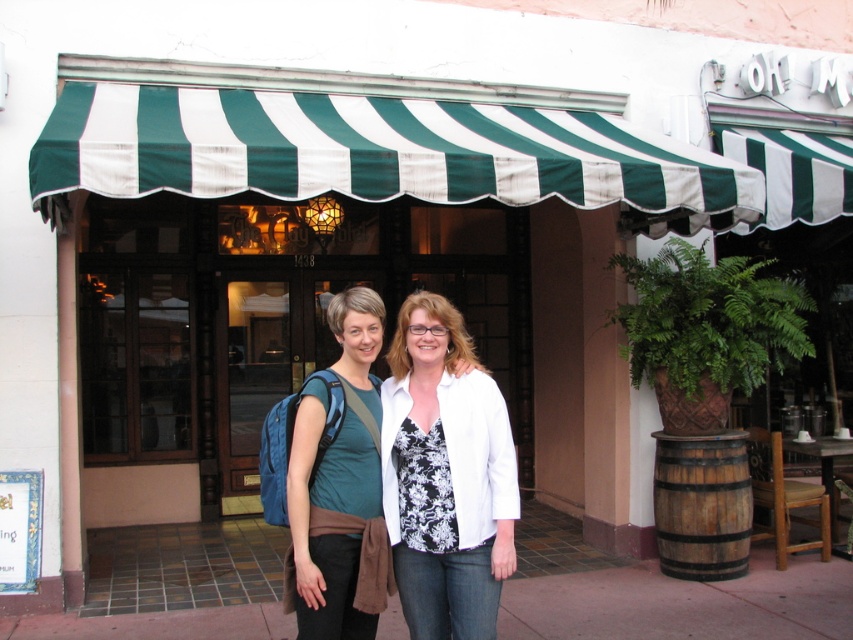
Is point (508, 540) positioned after point (312, 493)?

Yes, point (508, 540) is farther from viewer.

Who is more forward, (405, 376) or (329, 557)?

Point (329, 557) is more forward.

This screenshot has width=853, height=640. Identify the location of white matte jacket at center. (x=445, y=477).

From the picture: Is green striped awning at upper center closer to the viewer compared to teal fabric shirt at center?

That is False.

Describe the element at coordinates (372, 152) in the screenshot. I see `green striped awning at upper center` at that location.

Is point (196, 88) closer to viewer compared to point (349, 307)?

No, (196, 88) is further to viewer.

The height and width of the screenshot is (640, 853). In order to click on green striped awning at upper center in this screenshot , I will do `click(372, 152)`.

You are a GUI agent. You are given a task and a screenshot of the screen. Output one action in this format:
    pyautogui.click(x=<x>, y=<y>)
    Task: Click on the paved concrete sidewalk at center
    The image size is (853, 640).
    Given the screenshot: What is the action you would take?
    pyautogui.click(x=666, y=595)

Can you confirm if paved concrete sidewalk at center is shorter than teal fabric shirt at center?

Yes, paved concrete sidewalk at center is shorter than teal fabric shirt at center.

Is point (691, 596) behind point (341, 320)?

Yes, point (691, 596) is farther from viewer.

This screenshot has width=853, height=640. What are the coordinates of `paved concrete sidewalk at center` in the screenshot? It's located at point(666,595).